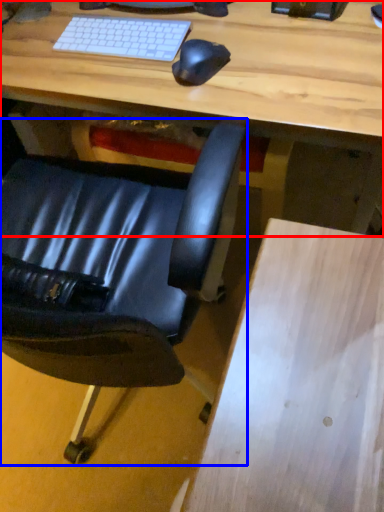
Question: Among these objects, which one is farthest to the camera, desk (highlighted by a red box) or chair (highlighted by a blue box)?

Choices:
 (A) desk
 (B) chair

Answer: (A)